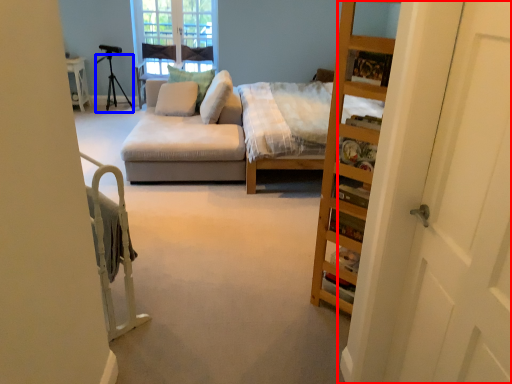
Question: Which point is further to the camera, door (highlighted by a red box) or tripod (highlighted by a blue box)?

Choices:
 (A) door
 (B) tripod

Answer: (B)